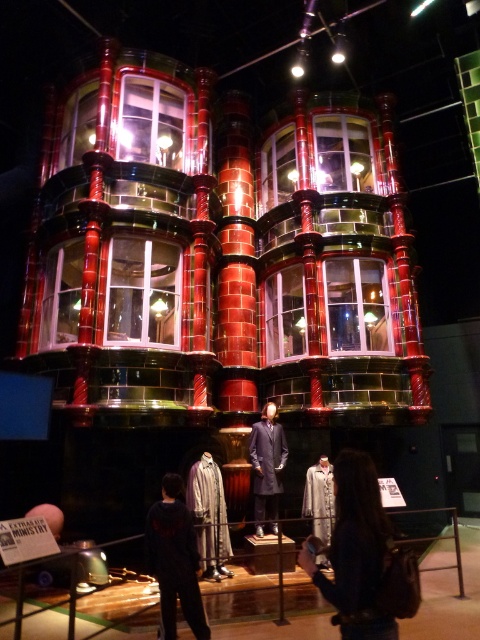
Looking at this image, you are an assistant in a magical wardrobe store. A customer wants to know if the dark gray fabric jacket at lower center can fit inside the silky white robe at center. Can it fit?

The dark gray fabric jacket at lower center is smaller than the silky white robe at center, so it can fit inside the silky white robe at center.

You are an assistant organizing a costume party. You have two items displayed on a stand in the center of the room. The items are the dark gray fabric jacket at lower center and the silky white robe at center. Which item takes up more space horizontally?

The silky white robe at center takes up more space horizontally because it has a greater width than the dark gray fabric jacket at lower center.